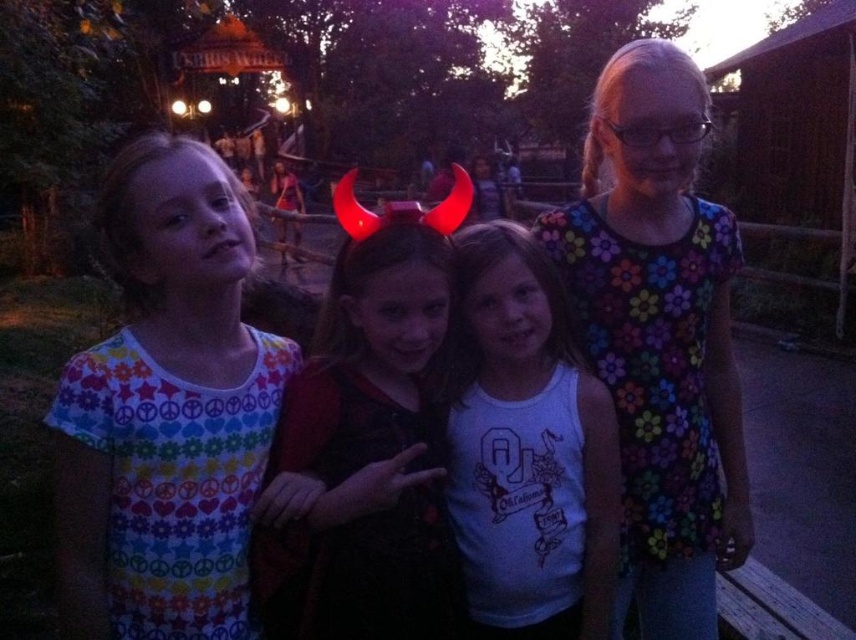
You are a photographer trying to capture a clear photo of the black velvet horns at center and the white cotton tank top at center in the low light. Which object should you focus on to ensure it appears sharp in the photo?

You should focus on the black velvet horns at center because they might be wider than the white cotton tank top at center, making them easier to capture sharply in low light conditions.